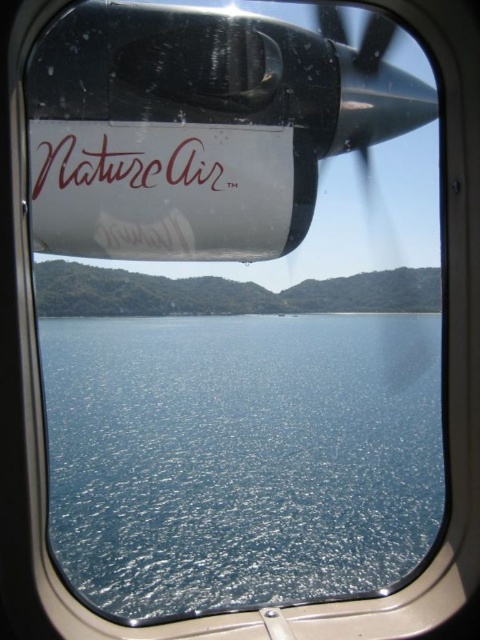
Question: Which object is closer to the camera taking this photo?

Choices:
 (A) blue glossy water at center
 (B) browncursive text at center

Answer: (A)

Question: Where is blue glossy water at center located in relation to browncursive text at center in the image?

Choices:
 (A) left
 (B) right

Answer: (A)

Question: Which object is farther from the camera taking this photo?

Choices:
 (A) browncursive text at center
 (B) blue glossy water at center

Answer: (A)

Question: Is blue glossy water at center behind browncursive text at center?

Choices:
 (A) yes
 (B) no

Answer: (B)

Question: Is blue glossy water at center to the left of browncursive text at center from the viewer's perspective?

Choices:
 (A) yes
 (B) no

Answer: (A)